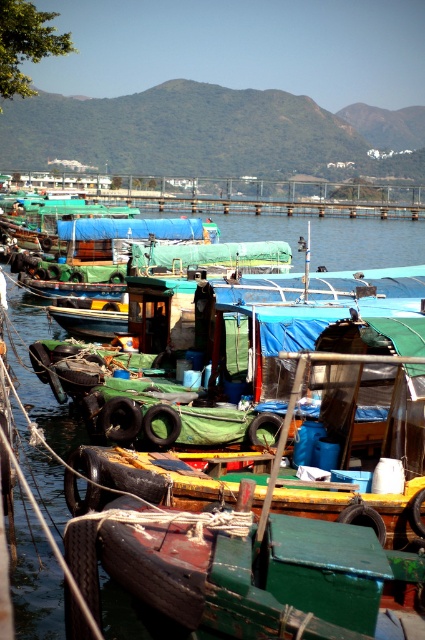
Is transparent plastic water at center to the right of green canvas boat at center from the viewer's perspective?

No, transparent plastic water at center is not to the right of green canvas boat at center.

Between transparent plastic water at center and green canvas boat at center, which one appears on the right side from the viewer's perspective?

From the viewer's perspective, green canvas boat at center appears more on the right side.

Find the location of `transparent plastic water at center`. transparent plastic water at center is located at coordinates (356, 237).

Identify the location of transparent plastic water at center. (356, 237).